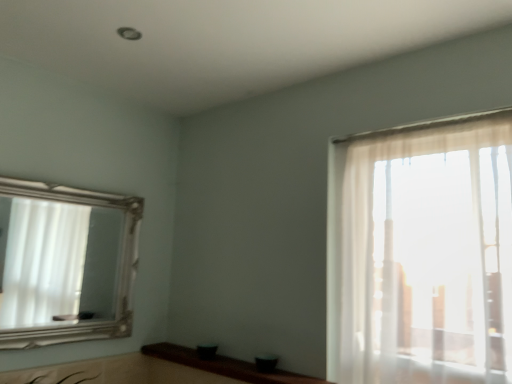
Question: Is silver/golden frame mirror at left wider than brown wood counter top at lower center?

Choices:
 (A) yes
 (B) no

Answer: (B)

Question: From a real-world perspective, is silver/golden frame mirror at left located beneath brown wood counter top at lower center?

Choices:
 (A) yes
 (B) no

Answer: (B)

Question: Is the position of silver/golden frame mirror at left less distant than that of brown wood counter top at lower center?

Choices:
 (A) yes
 (B) no

Answer: (B)

Question: Can you confirm if silver/golden frame mirror at left is shorter than brown wood counter top at lower center?

Choices:
 (A) no
 (B) yes

Answer: (A)

Question: Considering the relative sizes of silver/golden frame mirror at left and brown wood counter top at lower center in the image provided, is silver/golden frame mirror at left bigger than brown wood counter top at lower center?

Choices:
 (A) yes
 (B) no

Answer: (A)

Question: Is silver/golden frame mirror at left smaller than brown wood counter top at lower center?

Choices:
 (A) yes
 (B) no

Answer: (B)

Question: Could you tell me if brown wood counter top at lower center is turned towards silver/golden frame mirror at left?

Choices:
 (A) yes
 (B) no

Answer: (B)

Question: Considering the relative sizes of brown wood counter top at lower center and silver/golden frame mirror at left in the image provided, is brown wood counter top at lower center thinner than silver/golden frame mirror at left?

Choices:
 (A) no
 (B) yes

Answer: (A)

Question: Considering the relative sizes of brown wood counter top at lower center and silver/golden frame mirror at left in the image provided, is brown wood counter top at lower center taller than silver/golden frame mirror at left?

Choices:
 (A) no
 (B) yes

Answer: (A)

Question: Can you confirm if brown wood counter top at lower center is shorter than silver/golden frame mirror at left?

Choices:
 (A) yes
 (B) no

Answer: (A)

Question: From a real-world perspective, is brown wood counter top at lower center under silver/golden frame mirror at left?

Choices:
 (A) no
 (B) yes

Answer: (B)

Question: Does brown wood counter top at lower center have a greater width compared to silver/golden frame mirror at left?

Choices:
 (A) yes
 (B) no

Answer: (A)

Question: Based on their sizes in the image, would you say silver/golden frame mirror at left is bigger or smaller than brown wood counter top at lower center?

Choices:
 (A) small
 (B) big

Answer: (B)